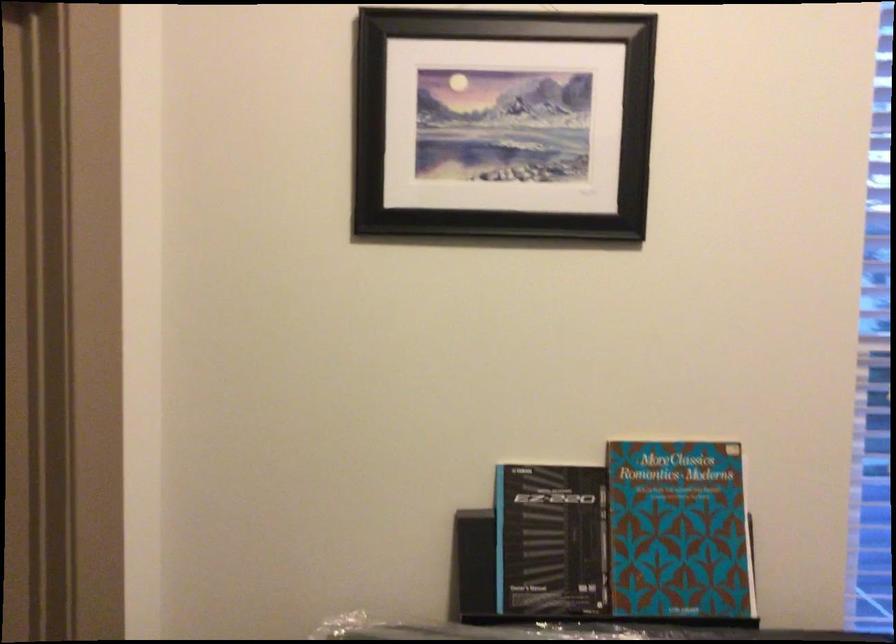
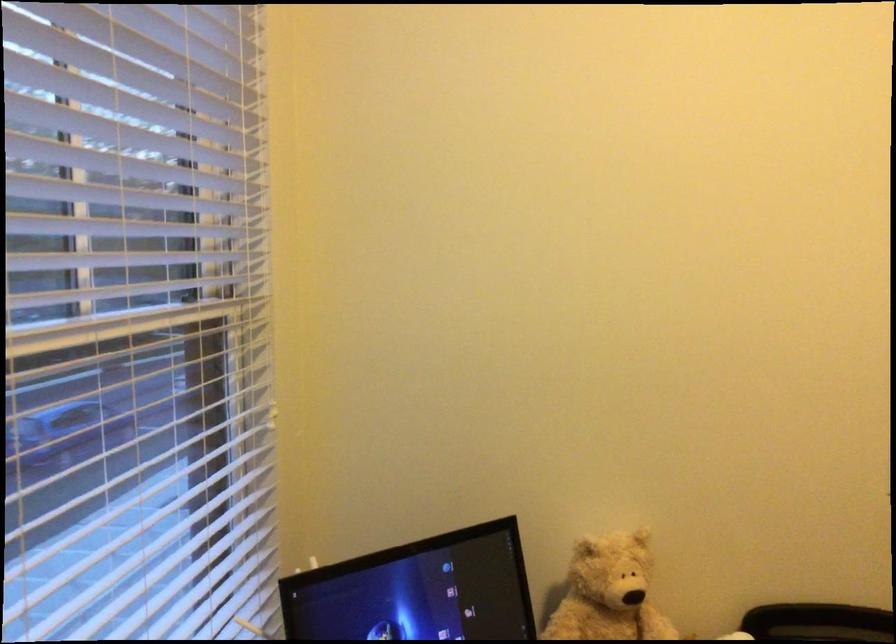
Question: How did the camera likely rotate?

Choices:
 (A) Left
 (B) Right
 (C) Up
 (D) Down

Answer: (B)